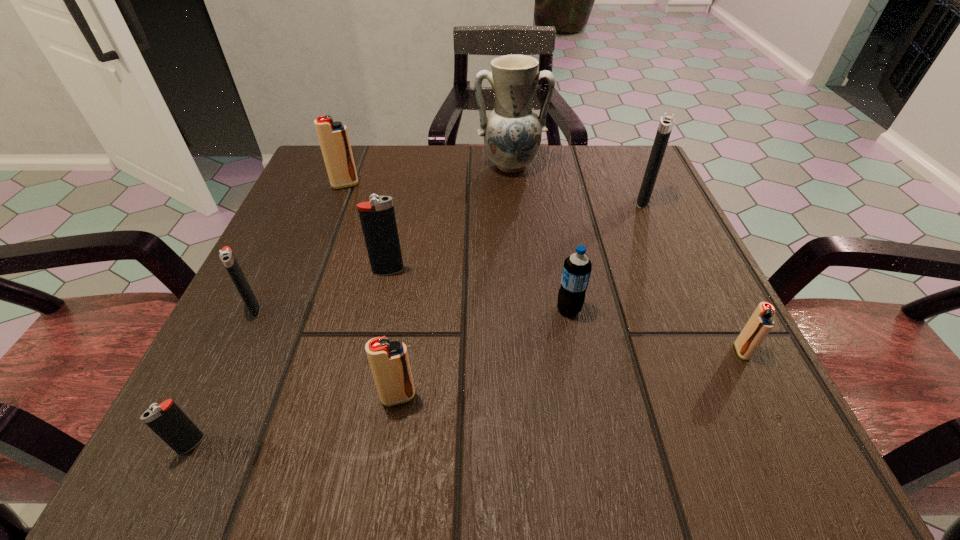
Image resolution: width=960 pixels, height=540 pixels. Identify the location of red igniter identified as the third closest to the nearest black igniter. (759, 325).

Identify which red igniter is located as the nearest to the fifth igniter from right to left. Please provide its 2D coordinates. Your answer should be formatted as a tuple, i.e. [(x, y)], where the tuple contains the x and y coordinates of a point satisfying the conditions above.

[(389, 361)]

The height and width of the screenshot is (540, 960). What are the coordinates of `free space that satisfies the following two spatial constraints: 1. on the back side of the smallest black igniter; 2. on the left side of the third nearest igniter` in the screenshot? It's located at (236, 352).